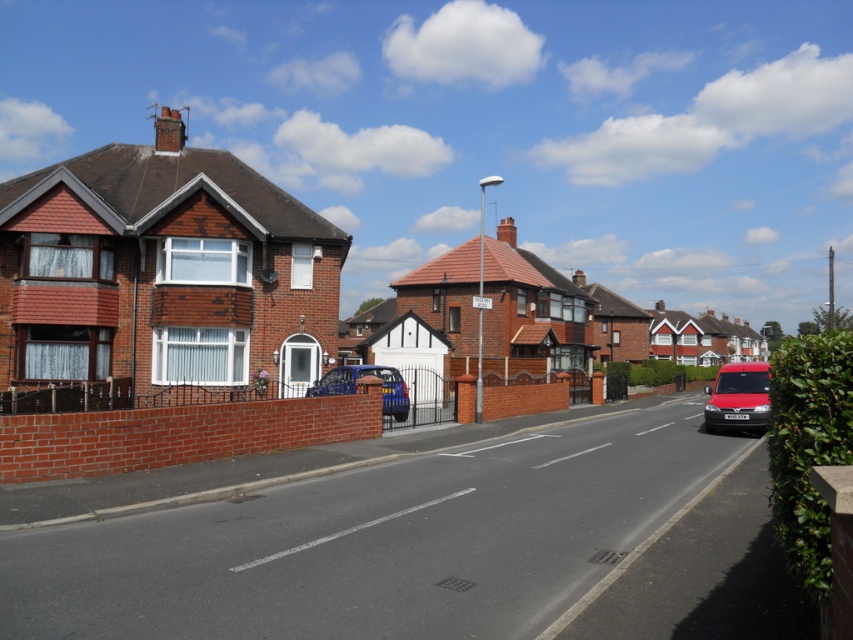
Who is more distant from viewer, [700,419] or [750,401]?

Point [700,419]

I want to click on smooth asphalt road at center, so click(x=376, y=541).

The width and height of the screenshot is (853, 640). Identify the location of smooth asphalt road at center. (376, 541).

Measure the distance between point (399, 525) and camera.

Point (399, 525) is 8.76 meters away from camera.

Between smooth asphalt road at center and metallic blue car at center, which one is positioned higher?

Positioned higher is metallic blue car at center.

Who is more distant from viewer, (602, 420) or (337, 372)?

Positioned behind is point (602, 420).

Image resolution: width=853 pixels, height=640 pixels. I want to click on smooth asphalt road at center, so click(376, 541).

Who is lower down, metallic red van at right or metallic blue car at center?

Positioned lower is metallic red van at right.

Which is behind, point (724, 422) or point (399, 380)?

Positioned behind is point (399, 380).

Locate an element on the screen. The width and height of the screenshot is (853, 640). metallic red van at right is located at coordinates (738, 397).